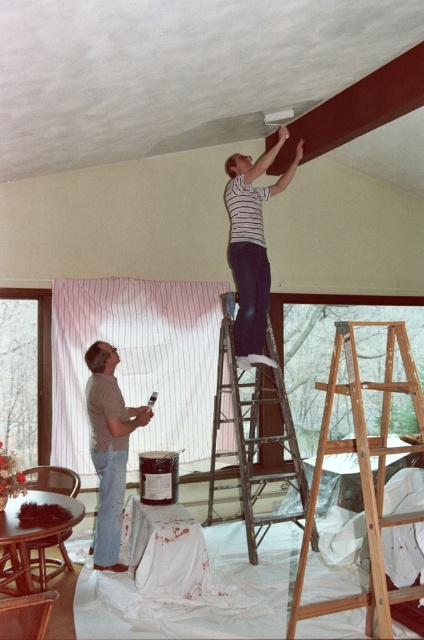
Looking at this image, you are standing in the room and want to reach the striped fabric at upper center. The longest tool you have is a 4.5 meter pole. Can you just barely reach it?

The distance between striped fabric at upper center and the viewer is 4.46 meters, so a 4.5 meter pole would allow you to just barely reach it.

From the picture: You need to place a 1.2 meter wide painting on the wall. The metallic silver ladder at center and gray matte shirt at lower left are in the way. Which object do you need to move to make space?

The metallic silver ladder at center might be wider than gray matte shirt at lower left, so you should move the metallic silver ladder at center to make space for the painting.